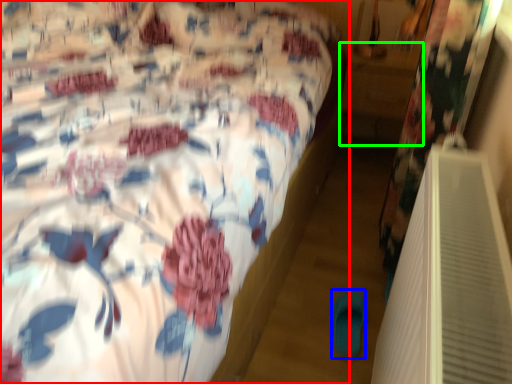
Question: Which object is positioned closest to bed (highlighted by a red box)? Select from slipper (highlighted by a blue box) and table (highlighted by a green box).

Choices:
 (A) slipper
 (B) table

Answer: (A)